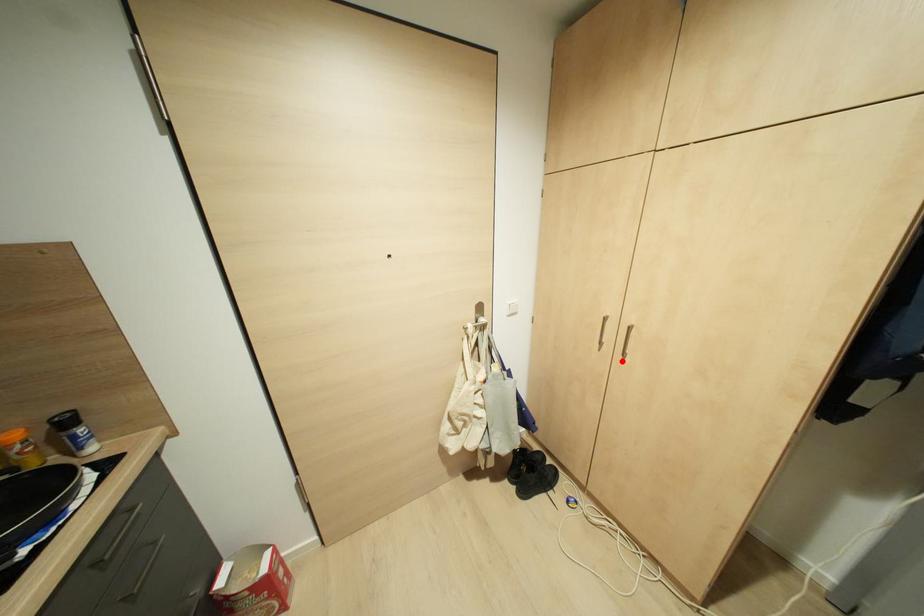
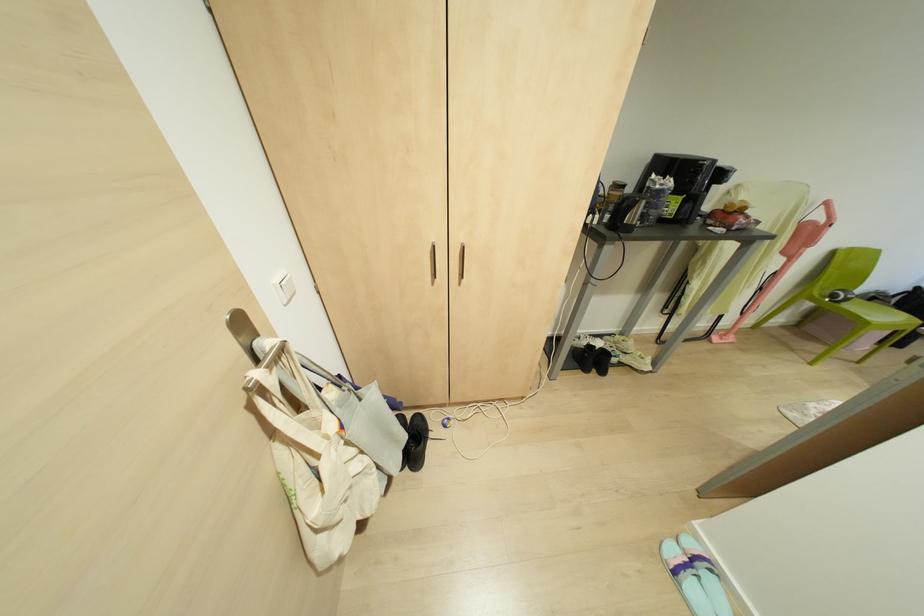
Locate, in the second image, the point that corresponds to the highlighted location in the first image.

(458, 284)